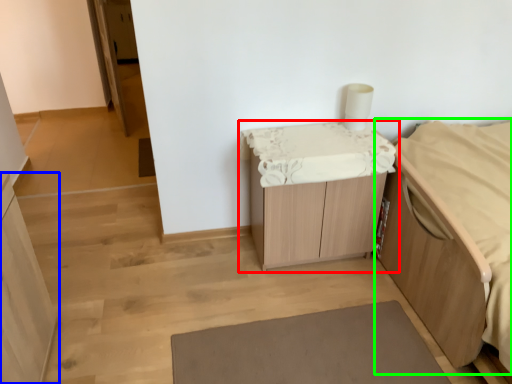
Question: Which is nearer to the table (highlighted by a red box)? cabinetry (highlighted by a blue box) or furniture (highlighted by a green box).

Choices:
 (A) cabinetry
 (B) furniture

Answer: (B)